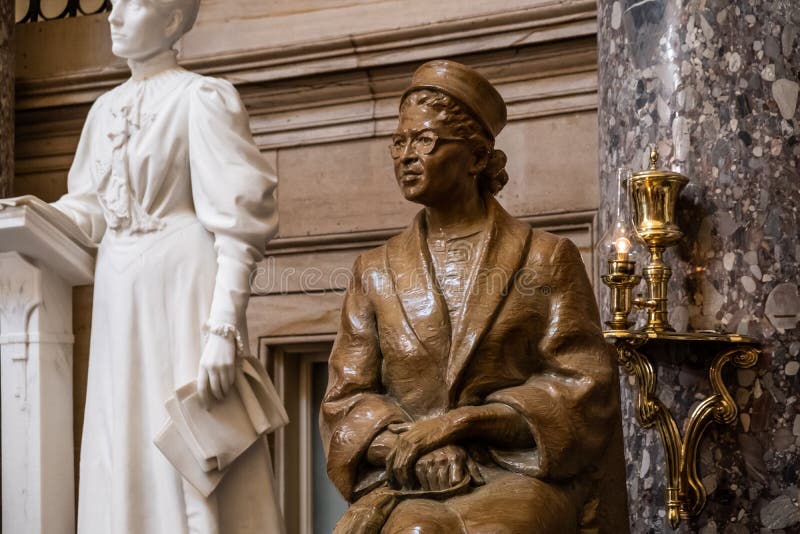
Where is `shelf`? Image resolution: width=800 pixels, height=534 pixels. shelf is located at coordinates (726, 400).